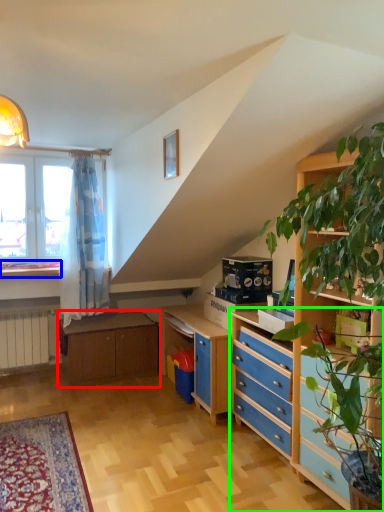
Question: Based on their relative distances, which object is nearer to table (highlighted by a red box)? Choose from window sill (highlighted by a blue box) and chest of drawers (highlighted by a green box).

Choices:
 (A) window sill
 (B) chest of drawers

Answer: (A)